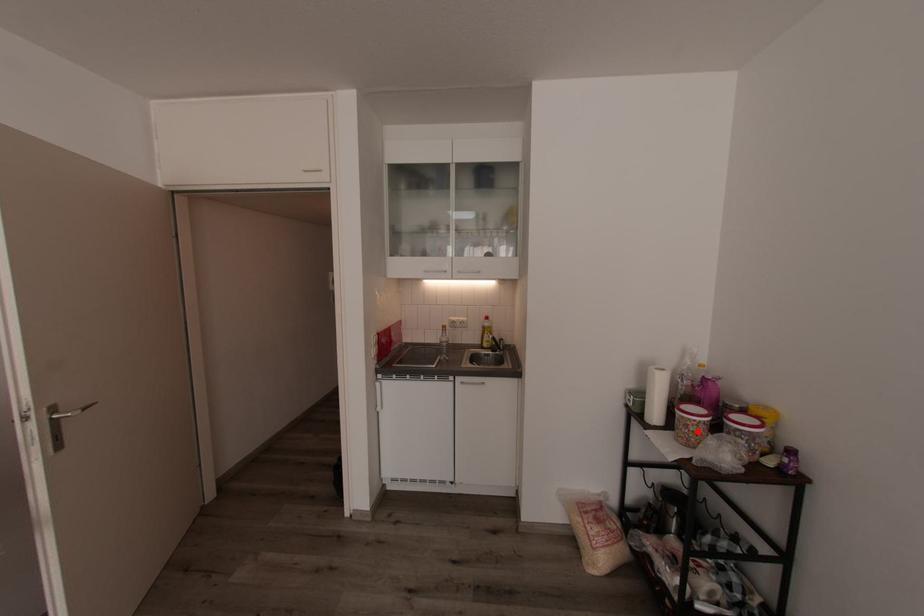
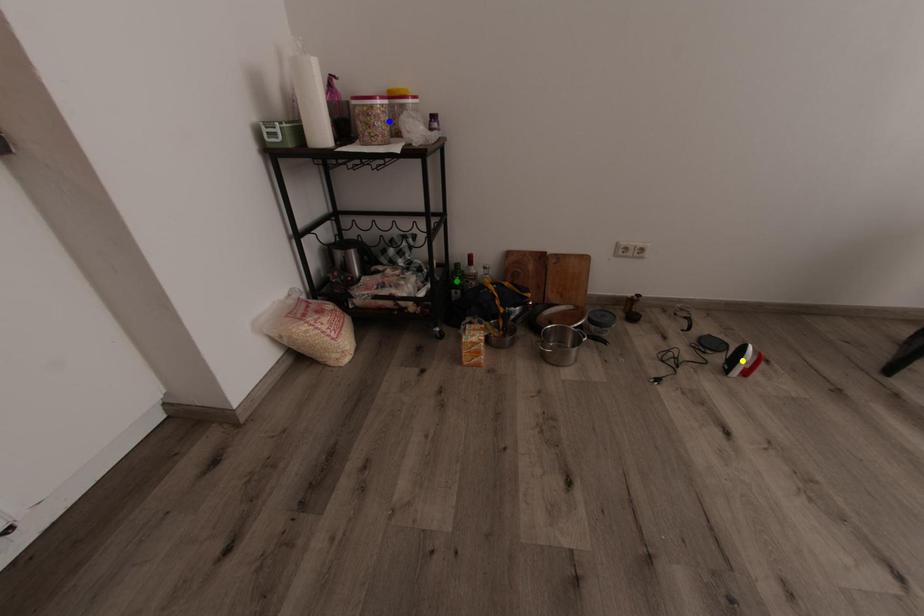
Question: I am providing you with two images of the same scene from different viewpoints. A red point is marked on the first image. You are given multiple points on the second image. In image 2, which mark is for the same physical point as the one in image 1?

Choices:
 (A) blue point
 (B) green point
 (C) yellow point

Answer: (A)